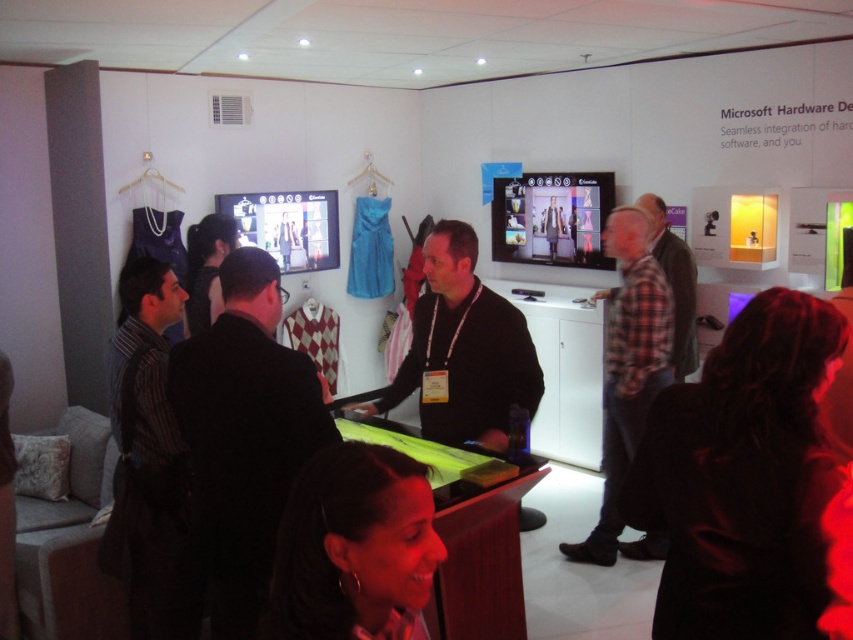
Question: Which point appears farthest from the camera in this image?

Choices:
 (A) (407, 488)
 (B) (602, 561)

Answer: (B)

Question: Which of these objects is positioned closest to the black fabric jacket at center?

Choices:
 (A) black matte jacket at center
 (B) plaid fabric shirt at right
 (C) dark brown hair at lower center
 (D) plaid fabric shirt at center

Answer: (C)

Question: Which object is positioned closest to the plaid fabric shirt at center?

Choices:
 (A) black fabric at center
 (B) black matte jacket at center
 (C) black fabric jacket at center
 (D) plaid fabric shirt at right

Answer: (D)

Question: Where is black fabric jacket at center located in relation to dark brown hair at lower center in the image?

Choices:
 (A) right
 (B) left

Answer: (B)

Question: Is dark brown hair at lower center to the left of plaid fabric shirt at right from the viewer's perspective?

Choices:
 (A) yes
 (B) no

Answer: (A)

Question: Can you confirm if plaid fabric shirt at right is thinner than plaid fabric shirt at center?

Choices:
 (A) yes
 (B) no

Answer: (B)